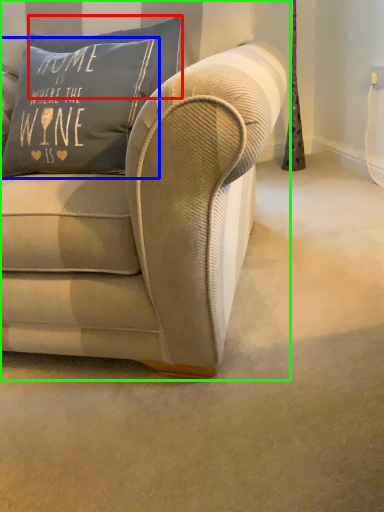
Question: Estimate the real-world distances between objects in this image. Which object is farther from pillow (highlighted by a red box), pillow (highlighted by a blue box) or studio couch (highlighted by a green box)?

Choices:
 (A) pillow
 (B) studio couch

Answer: (B)